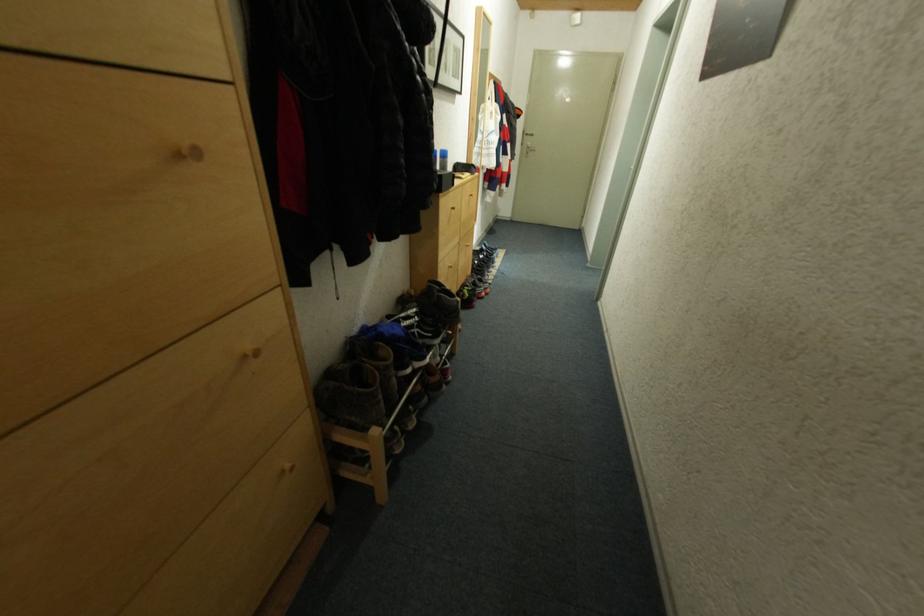
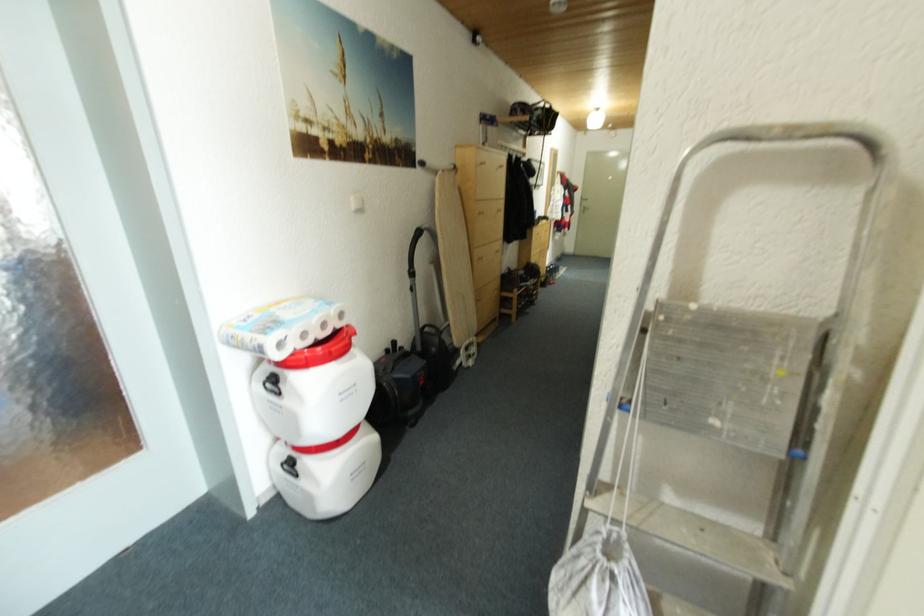
Question: The images are taken continuously from a first-person perspective. In which direction are you moving?

Choices:
 (A) Left
 (B) Right
 (C) Forward
 (D) Backward

Answer: (D)